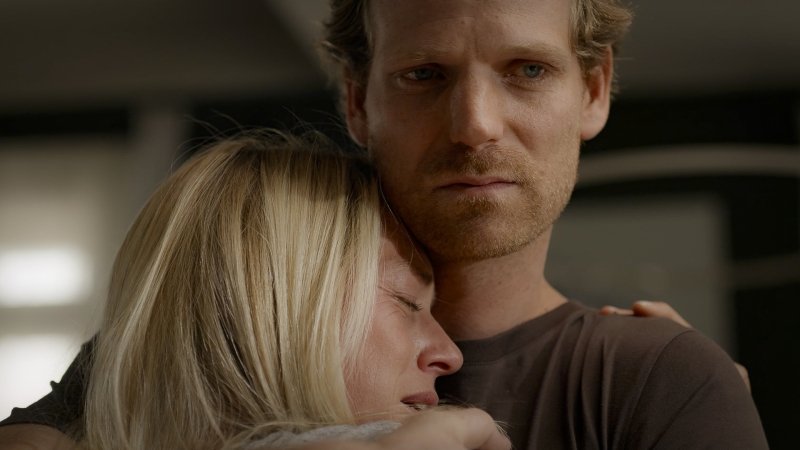
At what (x,y) coordinates should I click in order to perform the action: click on door. Please return your answer as a coordinate pair (x, y). Looking at the image, I should click on 674,244.